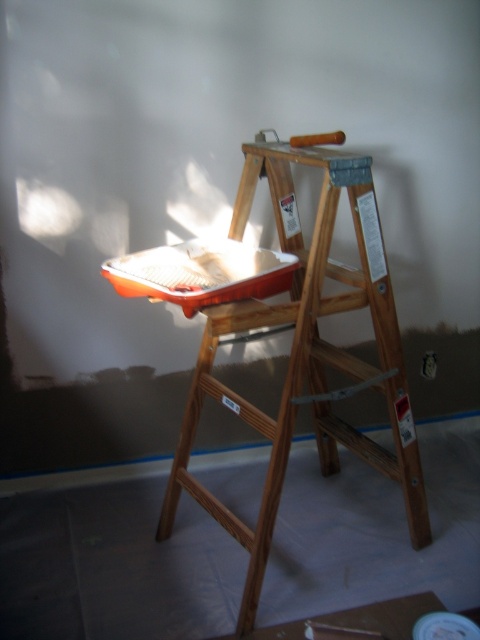
You are a painter who needs to place a 1.2 meter wide painting canvas between the wooden ladder at center and the metallic red tray at center. Can the canvas fit between them?

The wooden ladder at center is wider than the metallic red tray at center. However, the combined width of both objects is not provided, so it is impossible to determine if the 1.2 meter wide canvas can fit between them.

You are an interior designer who needs to retrieve the metallic red tray at center from the wooden ladder at center. Which direction should you move to access it?

The metallic red tray at center is behind the wooden ladder at center, so you should move to the back side of the wooden ladder at center to access it.

Consider the image. You are a painter who needs to place a 1.2 meter tall ladder in a room. You see the wooden ladder at center and the metallic red tray at center. Which object is more suitable for your task?

The wooden ladder at center is more suitable for your task because it has a larger size compared to the metallic red tray at center, which is smaller and not designed for climbing.